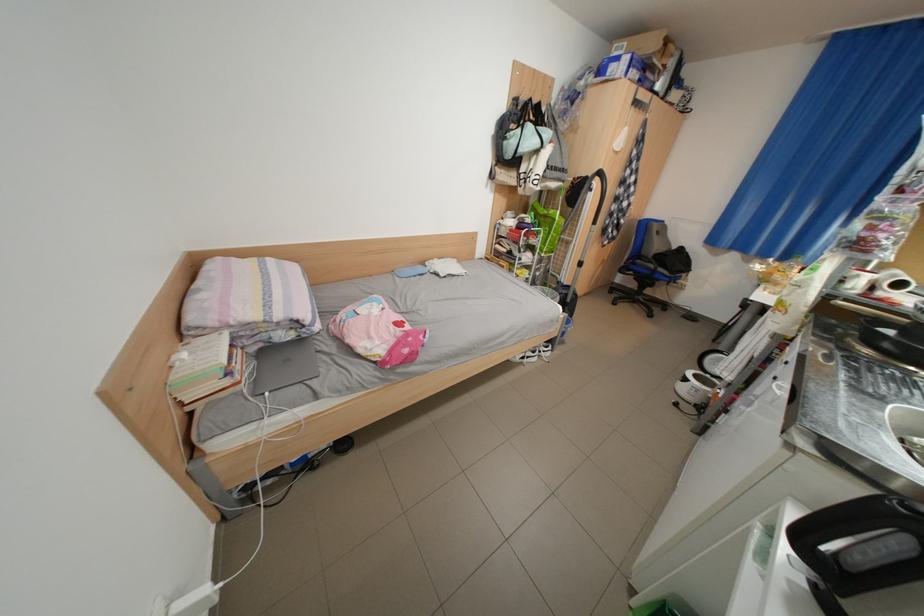
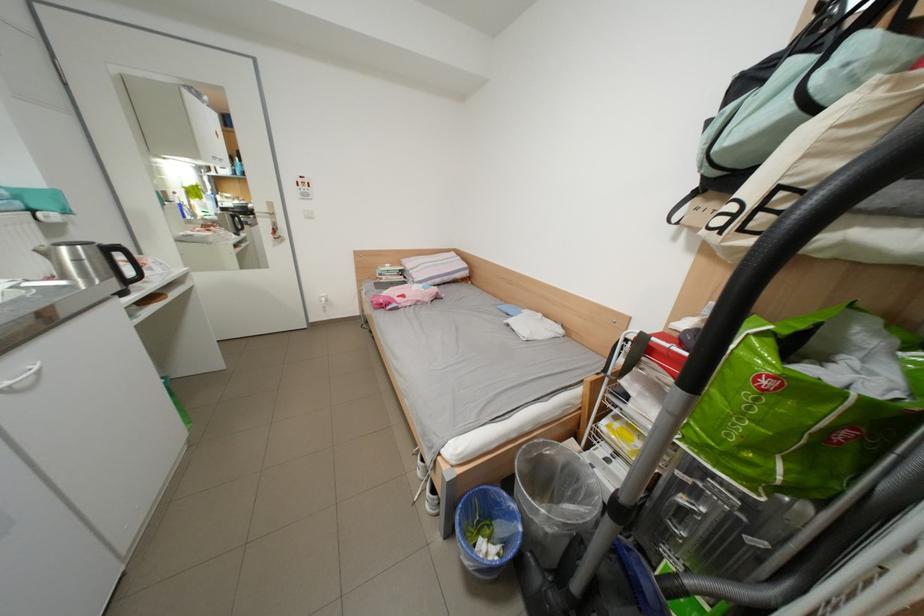
Find the pixel in the second image that matches point (789, 392) in the first image.

(46, 369)